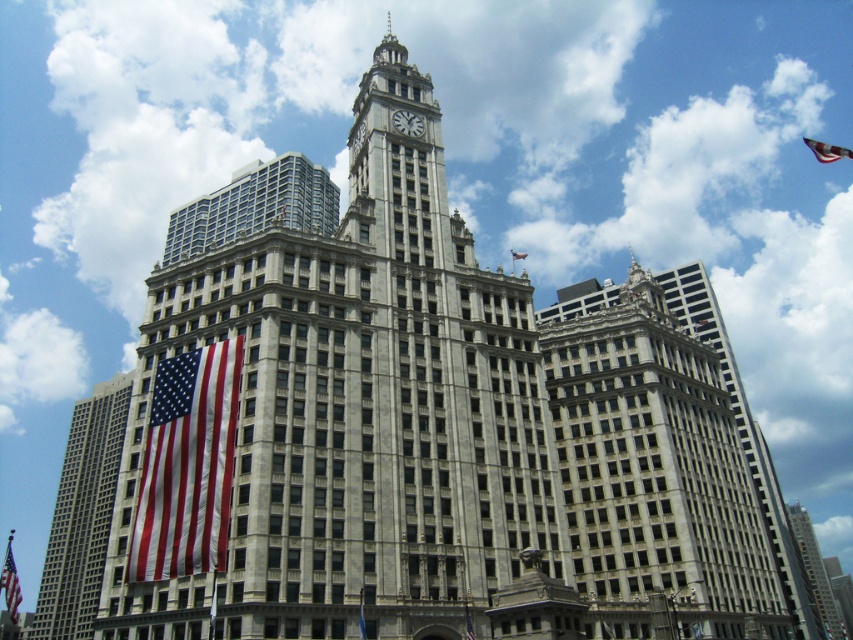
Question: Is gray stone building at center to the right of red fabric flag at center from the viewer's perspective?

Choices:
 (A) yes
 (B) no

Answer: (A)

Question: Which object is the closest to the gray stone building at center?

Choices:
 (A) white marble clock at upper center
 (B) red-white-and-blue fabric at left
 (C) red fabric flag at center
 (D) gray stone skyscraper at center

Answer: (B)

Question: Estimate the real-world distances between objects in this image. Which object is closer to the american flag at left?

Choices:
 (A) gray stone skyscraper at center
 (B) red fabric flag at center
 (C) red fabric flag at lower left

Answer: (C)

Question: Can you confirm if gray stone building at center is positioned below red fabric flag at upper center?

Choices:
 (A) yes
 (B) no

Answer: (A)

Question: Is white marble clock at upper center below red fabric flag at center?

Choices:
 (A) yes
 (B) no

Answer: (B)

Question: Which point is closer to the camera taking this photo?

Choices:
 (A) (96, 536)
 (B) (849, 154)

Answer: (A)